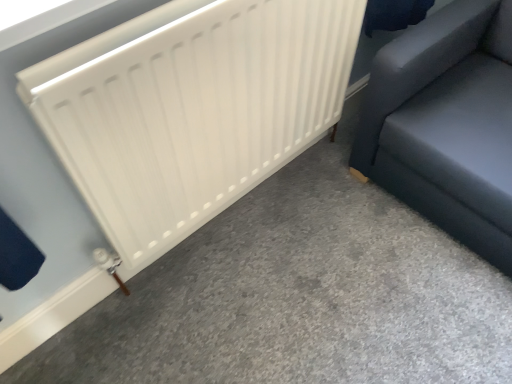
Describe the element at coordinates (297, 297) in the screenshot. I see `white matte radiator at left` at that location.

At what (x,y) coordinates should I click in order to perform the action: click on white matte radiator at left. Please return your answer as a coordinate pair (x, y). The height and width of the screenshot is (384, 512). Looking at the image, I should click on (297, 297).

From a real-world perspective, is white matte radiator at center positioned above or below white matte radiator at left?

white matte radiator at center is situated higher than white matte radiator at left in the real world.

Are white matte radiator at center and white matte radiator at left beside each other?

No, white matte radiator at center is not with white matte radiator at left.

Is white matte radiator at center at the left side of white matte radiator at left?

Yes.

From the image's perspective, is white matte radiator at center above or below white matte radiator at left?

From the image's perspective, white matte radiator at center appears above white matte radiator at left.

Does point (99, 362) appear closer or farther from the camera than point (199, 115)?

Point (99, 362) is positioned farther from the camera compared to point (199, 115).

Considering the positions of objects white matte radiator at left and white matte radiator at center in the image provided, who is more to the right, white matte radiator at left or white matte radiator at center?

white matte radiator at left.

Find the location of a particular element. This screenshot has width=512, height=384. radiator to the left of white matte radiator at left is located at coordinates 191,109.

Which object is positioned more to the right, white matte radiator at left or dark gray fabric sofa at right?

From the viewer's perspective, dark gray fabric sofa at right appears more on the right side.

Considering the points (350, 289) and (387, 50), which point is behind, point (350, 289) or point (387, 50)?

Point (350, 289)

Can you tell me how much white matte radiator at left and dark gray fabric sofa at right differ in facing direction?

The angular difference between white matte radiator at left and dark gray fabric sofa at right is 90 degrees.

Choose the correct answer: Is white matte radiator at left inside dark gray fabric sofa at right or outside it?

white matte radiator at left is not inside dark gray fabric sofa at right, it's outside.

In the image, is dark gray fabric sofa at right on the left side or the right side of white matte radiator at left?

dark gray fabric sofa at right is positioned on white matte radiator at left's right side.

Which is correct: dark gray fabric sofa at right is inside white matte radiator at left, or outside of it?

dark gray fabric sofa at right is not inside white matte radiator at left, it's outside.

Between dark gray fabric sofa at right and white matte radiator at left, which one has less height?

Standing shorter between the two is white matte radiator at left.

Who is smaller, dark gray fabric sofa at right or white matte radiator at left?

white matte radiator at left.

Is white matte radiator at center oriented towards dark gray fabric sofa at right?

No, white matte radiator at center is not turned towards dark gray fabric sofa at right.

The width and height of the screenshot is (512, 384). Identify the location of radiator on the left of dark gray fabric sofa at right. (191, 109).

Who is more distant, white matte radiator at center or dark gray fabric sofa at right?

Positioned behind is dark gray fabric sofa at right.

Does white matte radiator at center have a smaller size compared to dark gray fabric sofa at right?

Yes, white matte radiator at center is smaller than dark gray fabric sofa at right.

From the image's perspective, which one is positioned higher, dark gray fabric sofa at right or white matte radiator at center?

From the image's view, dark gray fabric sofa at right is above.

Is point (460, 189) closer or farther from the camera than point (211, 19)?

Point (460, 189) is farther from the camera than point (211, 19).

Is dark gray fabric sofa at right taller than white matte radiator at center?

Incorrect, the height of dark gray fabric sofa at right is not larger of that of white matte radiator at center.

Is dark gray fabric sofa at right not near white matte radiator at center?

dark gray fabric sofa at right is actually quite close to white matte radiator at center.

At what (x,y) coordinates should I click in order to perform the action: click on radiator above the white matte radiator at left (from a real-world perspective). Please return your answer as a coordinate pair (x, y). The width and height of the screenshot is (512, 384). Looking at the image, I should click on (191, 109).

This screenshot has width=512, height=384. Identify the location of radiator that appears in front of the white matte radiator at left. (191, 109).

Looking at this image, considering their positions, is dark gray fabric sofa at right positioned further to white matte radiator at center than white matte radiator at left?

Based on the image, white matte radiator at left appears to be further to white matte radiator at center.

Considering their positions, is white matte radiator at left positioned closer to dark gray fabric sofa at right than white matte radiator at center?

white matte radiator at left is closer to dark gray fabric sofa at right.

Based on the photo, which object lies further to the anchor point white matte radiator at left, dark gray fabric sofa at right or white matte radiator at center?

white matte radiator at center.

Which object lies further to the anchor point white matte radiator at center, white matte radiator at left or dark gray fabric sofa at right?

The object further to white matte radiator at center is white matte radiator at left.

Estimate the real-world distances between objects in this image. Which object is closer to dark gray fabric sofa at right, white matte radiator at center or white matte radiator at left?

white matte radiator at left lies closer to dark gray fabric sofa at right than the other object.

Consider the image. Estimate the real-world distances between objects in this image. Which object is closer to white matte radiator at left, white matte radiator at center or dark gray fabric sofa at right?

dark gray fabric sofa at right.

You are a GUI agent. You are given a task and a screenshot of the screen. Output one action in this format:
    pyautogui.click(x=<x>, y=<y>)
    Task: Click on the concrete between white matte radiator at center and dark gray fabric sofa at right
    This screenshot has width=512, height=384.
    Given the screenshot: What is the action you would take?
    pyautogui.click(x=297, y=297)